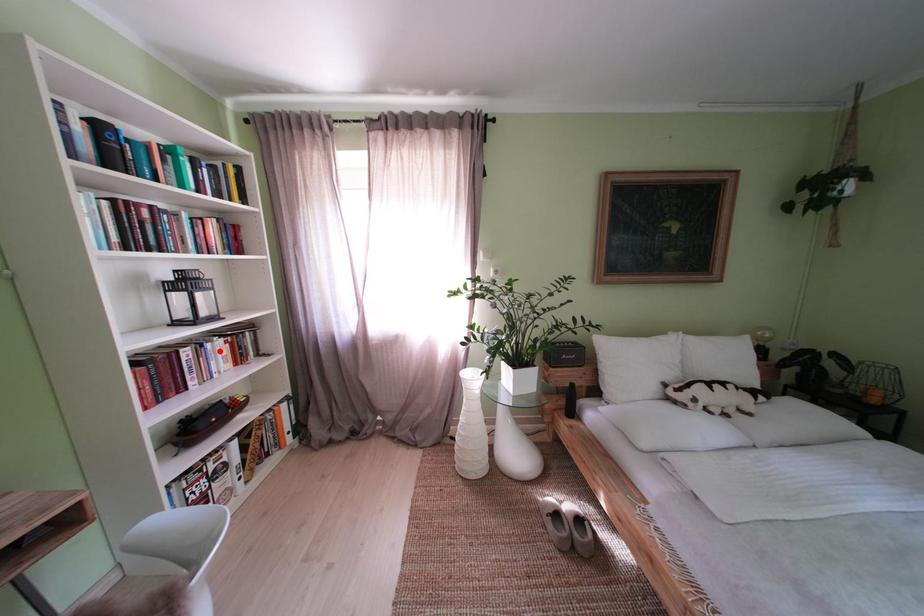
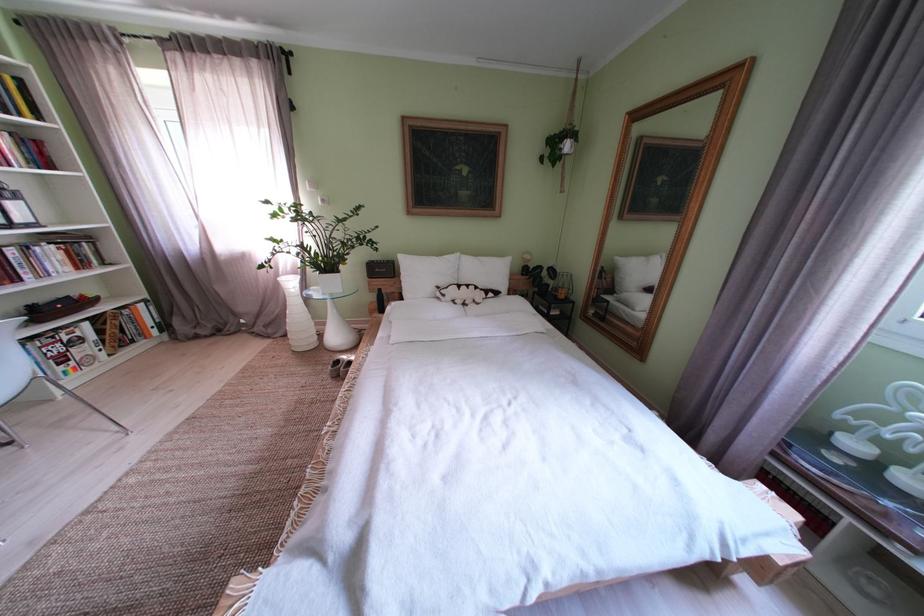
Find the pixel in the second image that matches the highlighted location in the first image.

(49, 254)